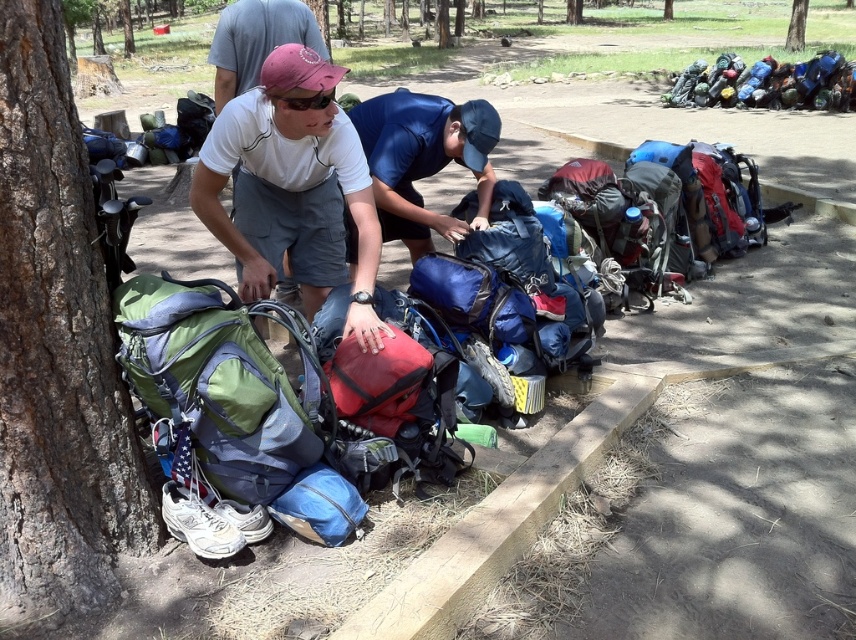
Question: Which of the following is the farthest from the observer?

Choices:
 (A) (806, 1)
 (B) (361, 420)
 (C) (278, 228)
 (D) (191, 400)

Answer: (A)

Question: Which object appears farthest from the camera in this image?

Choices:
 (A) blue fabric backpack at center
 (B) matte white t-shirt at center
 (C) concrete curb at center right
 (D) green fabric backpack at left

Answer: (C)

Question: Where is smooth bark tree at left located in relation to blue fabric backpack at center in the image?

Choices:
 (A) below
 (B) above

Answer: (A)

Question: Which of the following is the farthest from the observer?

Choices:
 (A) (385, 387)
 (B) (54, 140)
 (C) (849, 220)

Answer: (C)

Question: Considering the relative positions of concrete curb at center right and green bark tree at upper right in the image provided, where is concrete curb at center right located with respect to green bark tree at upper right?

Choices:
 (A) left
 (B) right

Answer: (A)

Question: Does blue fabric backpack at center appear under green bark tree at upper right?

Choices:
 (A) yes
 (B) no

Answer: (A)